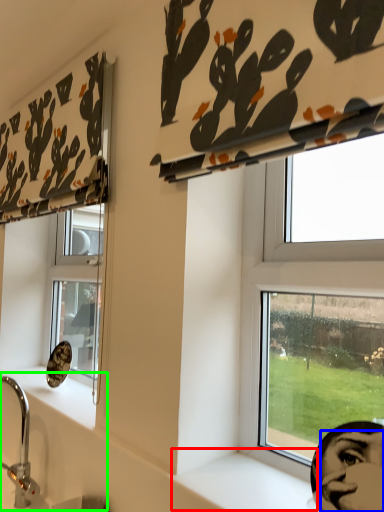
Question: Which object is the closest to the window sill (highlighted by a red box)? Choose among these: human face (highlighted by a blue box) or sink (highlighted by a green box).

Choices:
 (A) human face
 (B) sink

Answer: (A)